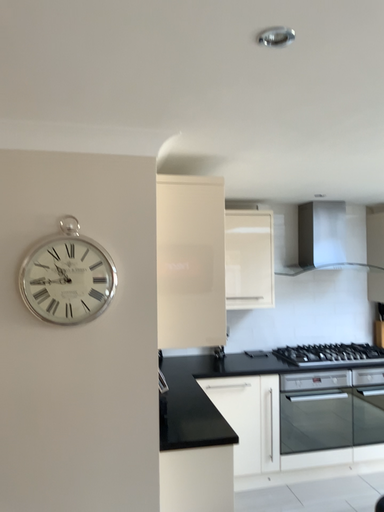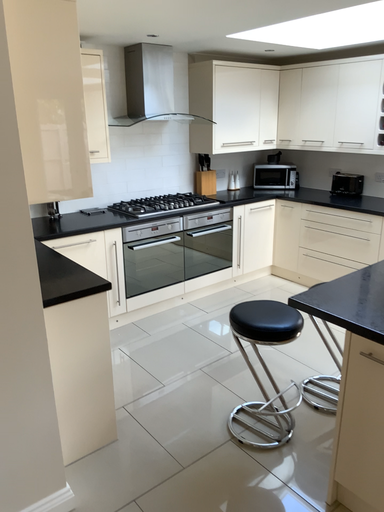
Question: Which way did the camera rotate in the video?

Choices:
 (A) rotated upward
 (B) rotated downward

Answer: (B)